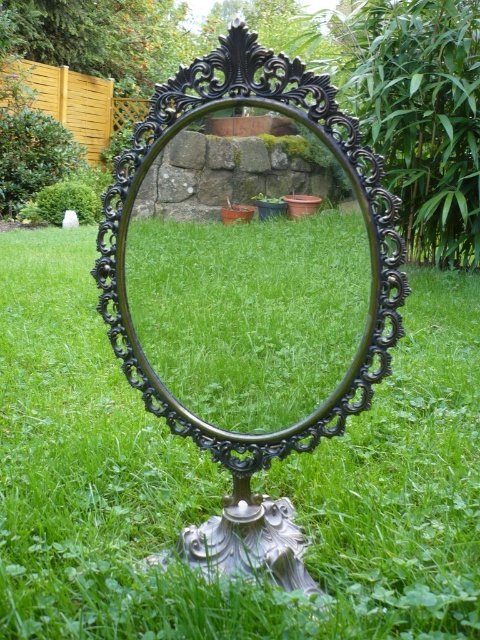
Can you confirm if green grass at center is wider than black ornate mirror at center?

Indeed, green grass at center has a greater width compared to black ornate mirror at center.

Is green grass at center to the right of black ornate mirror at center from the viewer's perspective?

Correct, you'll find green grass at center to the right of black ornate mirror at center.

Find the location of a particular element. The width and height of the screenshot is (480, 640). green grass at center is located at coordinates (227, 480).